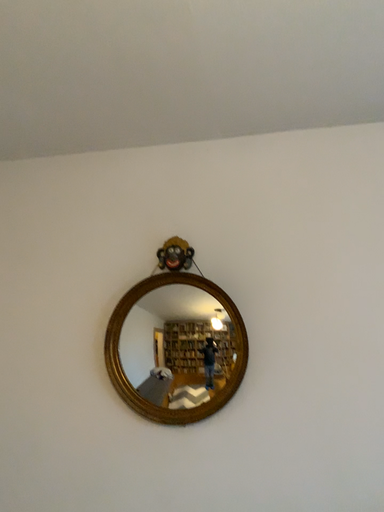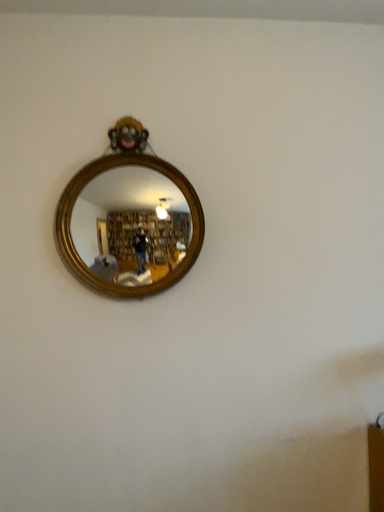
Question: How did the camera likely rotate when shooting the video?

Choices:
 (A) rotated right
 (B) rotated left

Answer: (A)